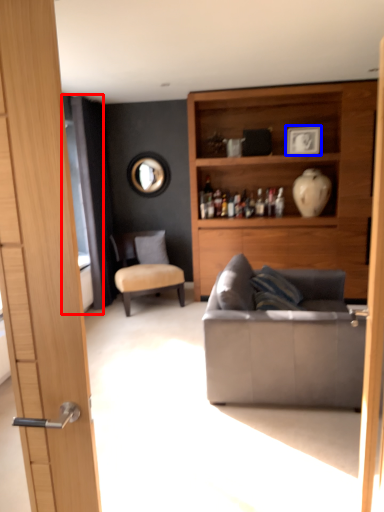
Question: Among these objects, which one is nearest to the camera, screen door (highlighted by a red box) or picture frame (highlighted by a blue box)?

Choices:
 (A) screen door
 (B) picture frame

Answer: (A)